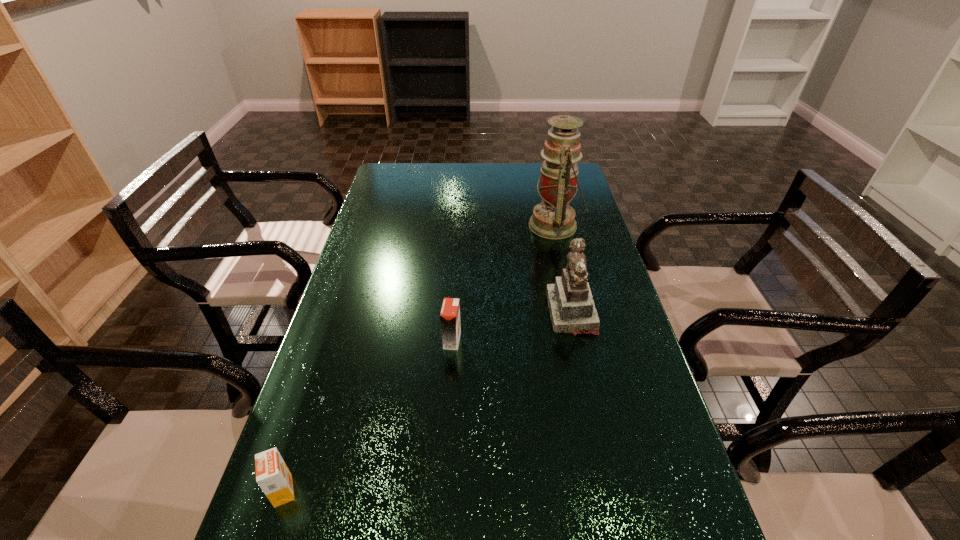
Identify the location of free point between the leftmost object and the oil lamp. (420, 358).

Identify the location of free space between the farthest object and the farther orange juice. [x=504, y=283].

Where is `vacant area that lies between the right orange juice and the farthest object`? vacant area that lies between the right orange juice and the farthest object is located at coordinates (504, 283).

Locate which object ranks second in proximity to the second object from left to right. Please provide its 2D coordinates. Your answer should be formatted as a tuple, i.e. [(x, y)], where the tuple contains the x and y coordinates of a point satisfying the conditions above.

[(272, 475)]

The height and width of the screenshot is (540, 960). Identify the location of object that is the nearest to the oil lamp. coord(572,310).

The height and width of the screenshot is (540, 960). What are the coordinates of `the closest orange juice to the tallest object` in the screenshot? It's located at (450, 312).

Where is `blank area in the image that satisfies the following two spatial constraints: 1. on the front side of the farthest object; 2. on the front-facing side of the third shortest object`? This screenshot has height=540, width=960. blank area in the image that satisfies the following two spatial constraints: 1. on the front side of the farthest object; 2. on the front-facing side of the third shortest object is located at coordinates (575, 313).

Identify the location of vacant space that satisfies the following two spatial constraints: 1. on the front-facing side of the third shortest object; 2. on the front side of the nearest object. (611, 491).